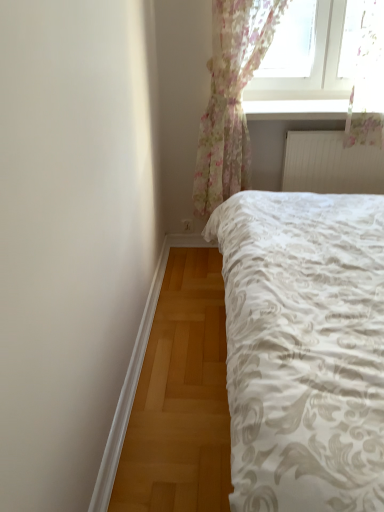
Question: Considering the relative positions of floral sheer curtain at upper right and white textured bed at center in the image provided, is floral sheer curtain at upper right to the left or to the right of white textured bed at center?

Choices:
 (A) left
 (B) right

Answer: (A)

Question: Is point (248, 13) closer or farther from the camera than point (321, 485)?

Choices:
 (A) farther
 (B) closer

Answer: (A)

Question: Based on their relative distances, which object is nearer to the floral sheer curtain at upper right?

Choices:
 (A) white textured radiator at upper right
 (B) white textured bed at center

Answer: (A)

Question: Which is farther from the white textured radiator at upper right?

Choices:
 (A) floral sheer curtain at upper right
 (B) white textured bed at center

Answer: (B)